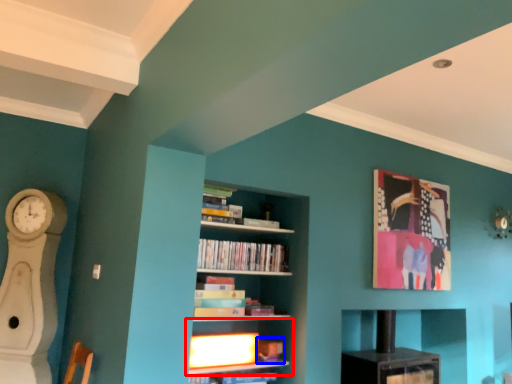
Question: Which of the following is the closest to the observer, shelf (highlighted by a red box) or book (highlighted by a blue box)?

Choices:
 (A) shelf
 (B) book

Answer: (A)